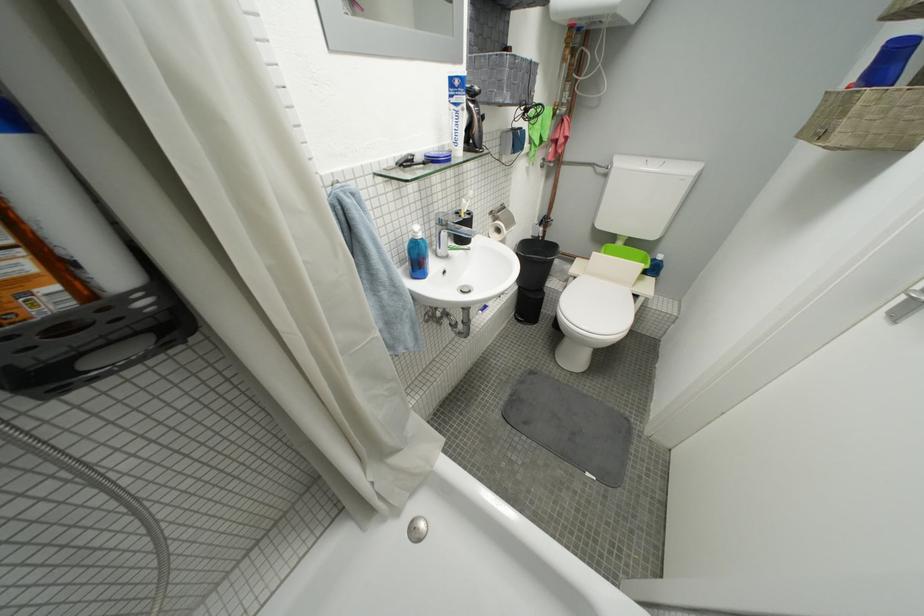
Where would you lift the toilet seat? Please return your answer as a coordinate pair (x, y).

(600, 306)